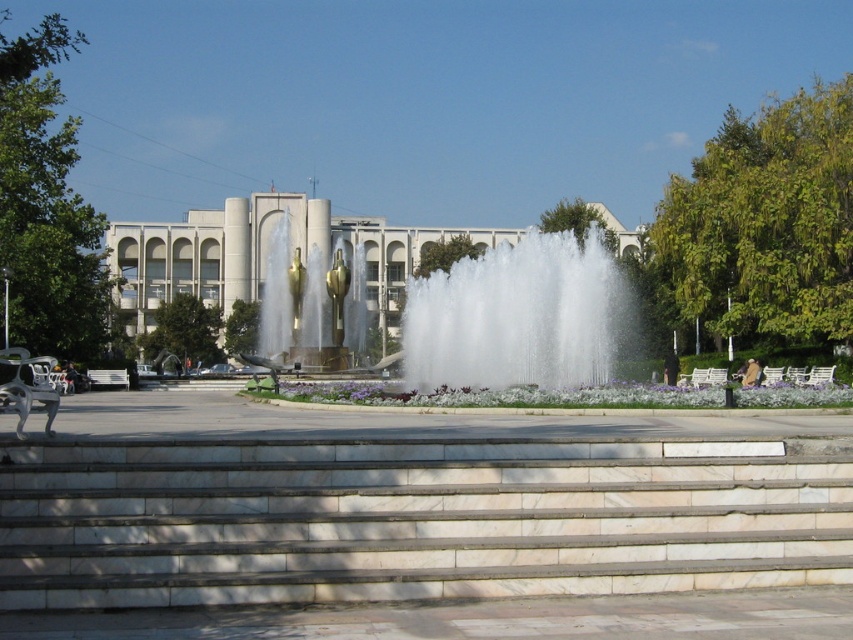
How far apart are white marble stairs at center and white frothy water at center?

A distance of 89.58 feet exists between white marble stairs at center and white frothy water at center.

Between white marble stairs at center and white frothy water at center, which one has more height?

Standing taller between the two is white frothy water at center.

You are a GUI agent. You are given a task and a screenshot of the screen. Output one action in this format:
    pyautogui.click(x=<x>, y=<y>)
    Task: Click on the white marble stairs at center
    The height and width of the screenshot is (640, 853).
    Given the screenshot: What is the action you would take?
    pyautogui.click(x=410, y=520)

Can you confirm if white marble stairs at center is positioned to the left of gold polished water at center?

Incorrect, white marble stairs at center is not on the left side of gold polished water at center.

Can you confirm if white marble stairs at center is smaller than gold polished water at center?

Yes.

Between point (796, 522) and point (318, 257), which one is positioned in front?

Point (796, 522) is more forward.

Identify the location of white marble stairs at center. (410, 520).

Measure the distance between point (595, 276) and camera.

Point (595, 276) is 104.71 feet away from camera.

Can you confirm if white frothy water at center is smaller than gold polished water at center?

No.

Who is more forward, (579,291) or (315,336)?

Point (579,291) is in front.

Identify the location of white frothy water at center. (518, 316).